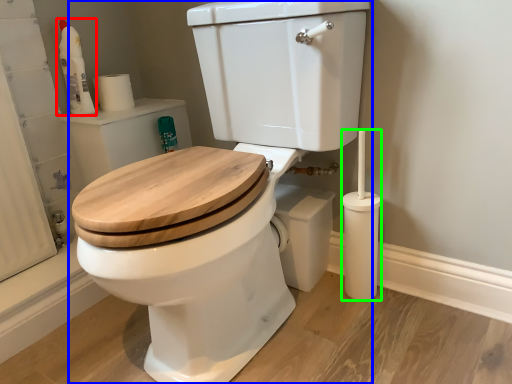
Question: Which object is positioned farthest from cleaning product (highlighted by a red box)? Select from toilet (highlighted by a blue box) and brush (highlighted by a green box).

Choices:
 (A) toilet
 (B) brush

Answer: (B)